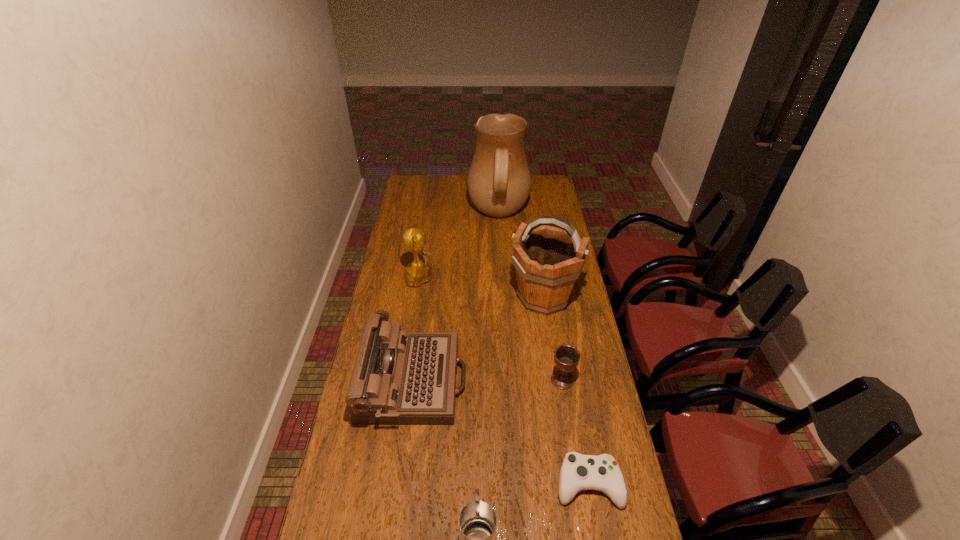
The height and width of the screenshot is (540, 960). Find the location of `free location located 0.140m on the front side of the award`. free location located 0.140m on the front side of the award is located at coordinates (474, 277).

Find the location of a particular element. Image resolution: width=960 pixels, height=540 pixels. vacant space located 0.210m on the keyboard of the typewriter is located at coordinates (522, 381).

Where is `free point located on the left of the chalice`? free point located on the left of the chalice is located at coordinates point(447,380).

Locate an element on the screen. vacant space situated on the left of the shortest object is located at coordinates (484, 484).

Identify the location of object located at the far edge. This screenshot has width=960, height=540. (499, 181).

I want to click on award that is at the left edge, so click(418, 272).

Find the location of a particular element. The width and height of the screenshot is (960, 540). typewriter located in the left edge section of the desktop is located at coordinates (399, 377).

Image resolution: width=960 pixels, height=540 pixels. Identify the location of bucket at the right edge. (548, 260).

Find the location of a particular element. chalice present at the right edge is located at coordinates (566, 357).

I want to click on control that is positioned at the right edge, so click(x=578, y=472).